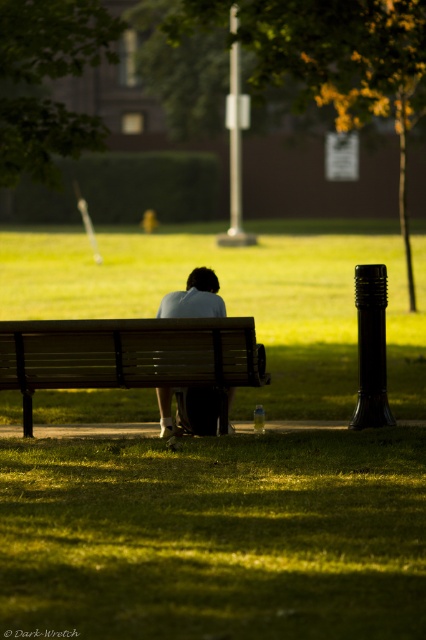
Looking at the park scene, there are two green leafy trees in the image. The first is the green leafy tree at upper center and the second is the green leafy tree at upper left. From the perspective of someone standing at the bench, which tree is positioned to the right?

The green leafy tree at upper center is positioned to the right of the green leafy tree at upper left.

You are a park visitor holding a 10 meter long rope. You want to tie the light blue fabric shirt at center to the green leafy tree at upper center. Is the rope long enough?

The distance between the green leafy tree at upper center and the light blue fabric shirt at center is 8.41 meters. Since the rope is 10 meters long, it is sufficient to tie them together.